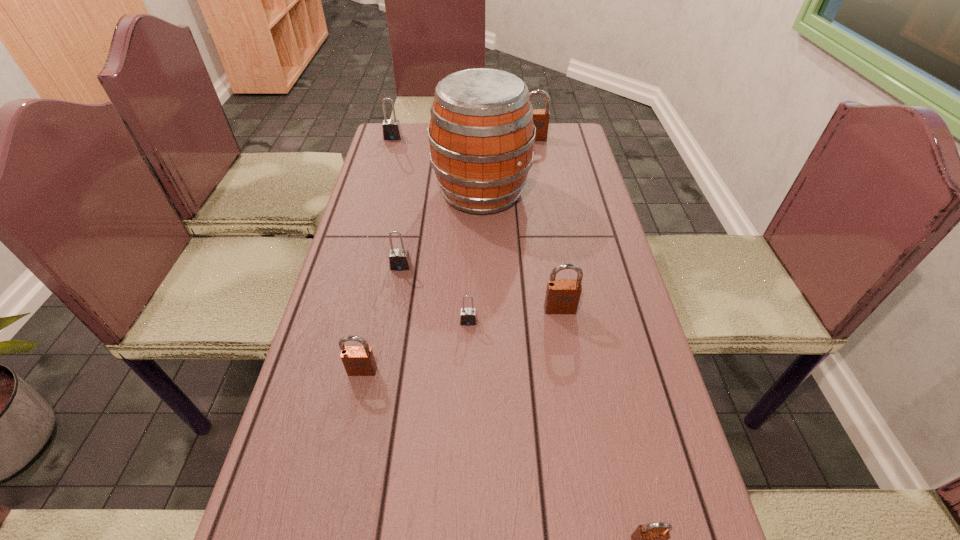
The height and width of the screenshot is (540, 960). I want to click on blank area located on the shackle of the fourth padlock from right to left, so click(x=468, y=367).

Identify the location of object located at the far left corner. This screenshot has width=960, height=540. (391, 128).

Find the location of a particular element. object situated at the far right corner is located at coordinates (541, 117).

You are a GUI agent. You are given a task and a screenshot of the screen. Output one action in this format:
    pyautogui.click(x=<x>, y=<y>)
    Task: Click on the free space at the left edge
    This screenshot has width=960, height=540.
    Given the screenshot: What is the action you would take?
    pyautogui.click(x=318, y=368)

Locate an element on the screen. vacant region at the right edge of the desktop is located at coordinates (646, 363).

I want to click on blank area at the far left corner, so click(x=402, y=122).

I want to click on vacant space at the far right corner of the desktop, so click(x=581, y=134).

I want to click on empty space between the third smallest brown padlock and the leftmost brown padlock, so click(461, 340).

Identify the location of vacant space that is in between the third farthest object and the fourth farthest padlock. (521, 251).

Locate an element on the screen. Image resolution: width=960 pixels, height=540 pixels. unoccupied position between the second nearest gray padlock and the farthest gray padlock is located at coordinates point(396,202).